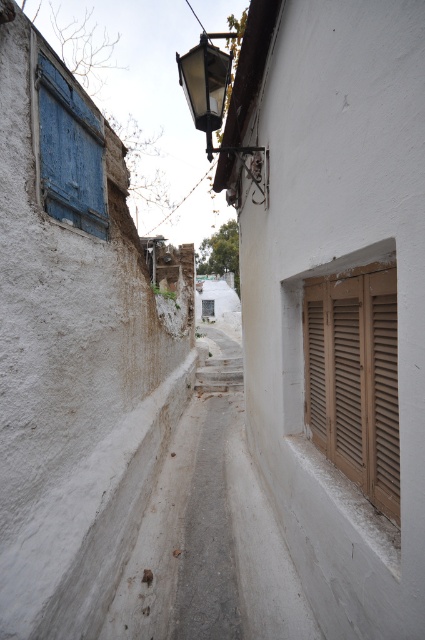
Is point (385, 301) positioned behind point (204, 49)?

That is False.

Which is more to the left, brown wooden shutters at right or matte black lamp at upper center?

Positioned to the left is matte black lamp at upper center.

This screenshot has height=640, width=425. I want to click on brown wooden shutters at right, so click(x=354, y=380).

The width and height of the screenshot is (425, 640). Find the location of `brown wooden shutters at right`. brown wooden shutters at right is located at coordinates (354, 380).

Can you confirm if brown wooden shutters at right is positioned to the right of blue painted wood at left?

Correct, you'll find brown wooden shutters at right to the right of blue painted wood at left.

This screenshot has width=425, height=640. Describe the element at coordinates (354, 380) in the screenshot. I see `brown wooden shutters at right` at that location.

At what (x,y) coordinates should I click in order to perform the action: click on brown wooden shutters at right. Please return your answer as a coordinate pair (x, y). This screenshot has height=640, width=425. Looking at the image, I should click on (354, 380).

Does point (68, 129) lie behind point (209, 88)?

No, it is in front of (209, 88).

Can you confirm if blue painted wood at left is taller than matte black lamp at upper center?

Yes, blue painted wood at left is taller than matte black lamp at upper center.

Is point (96, 236) farther from camera compared to point (198, 92)?

Yes, it is behind point (198, 92).

Where is `blue painted wood at left`? The image size is (425, 640). blue painted wood at left is located at coordinates (68, 150).